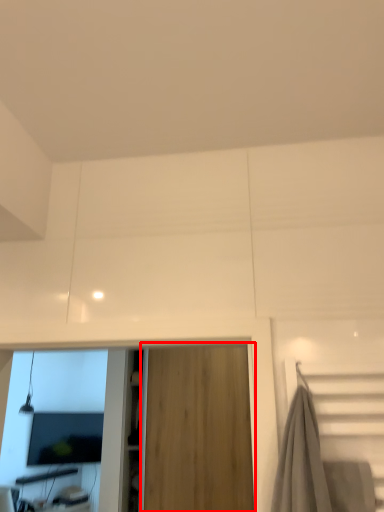
Question: From the image's perspective, what is the correct spatial positioning of garage door (annotated by the red box) in reference to computer monitor?

Choices:
 (A) below
 (B) above

Answer: (B)